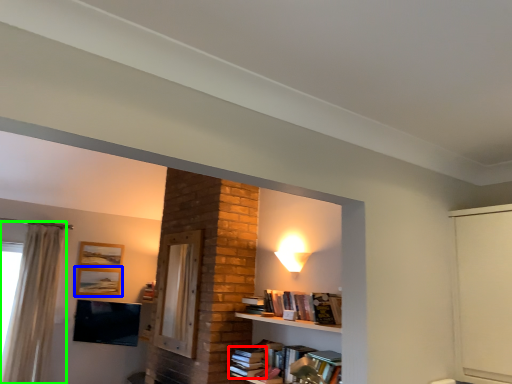
Question: Based on their relative distances, which object is nearer to book (highlighted by a red box)? Choose from picture frame (highlighted by a blue box) and curtain (highlighted by a green box).

Choices:
 (A) picture frame
 (B) curtain

Answer: (B)